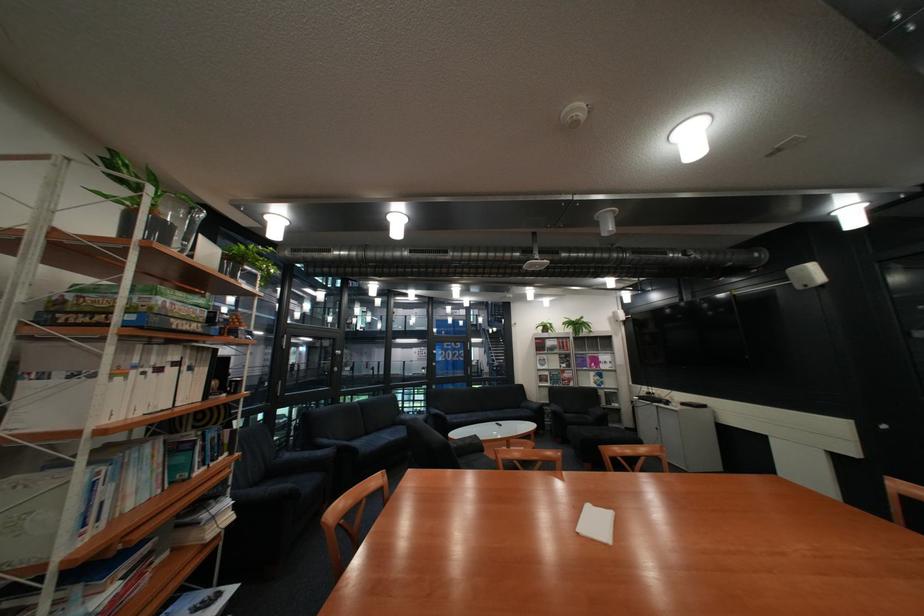
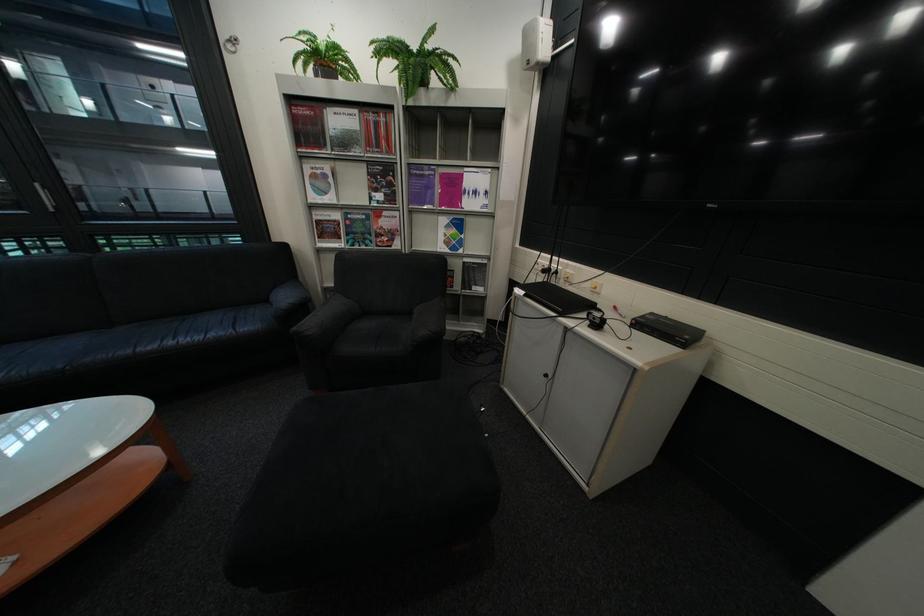
In the second image, find the point that corresponds to (x=618, y=367) in the first image.

(484, 204)